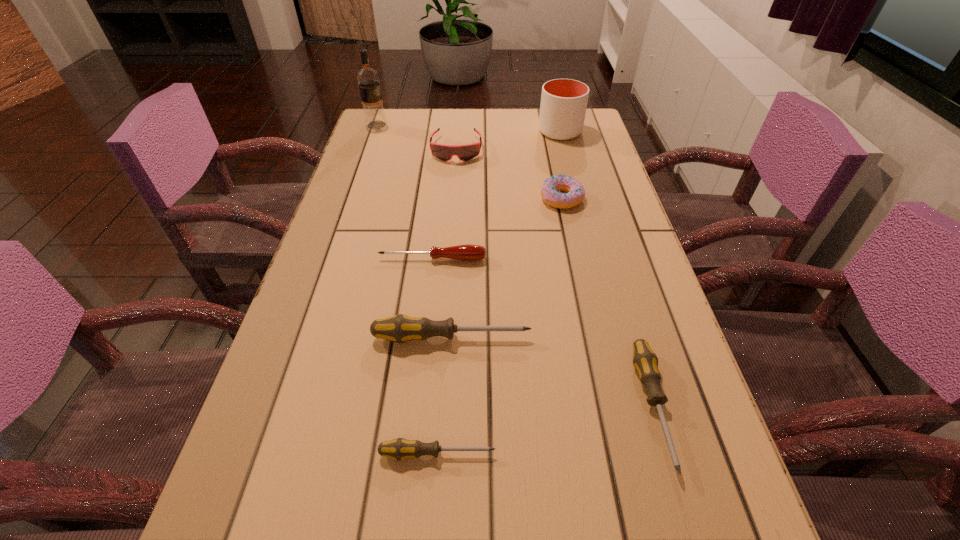
At what (x,y) coordinates should I click in order to perform the action: click on object at the far right corner. Please return your answer as a coordinate pair (x, y). This screenshot has width=960, height=540. Looking at the image, I should click on (563, 106).

You are a GUI agent. You are given a task and a screenshot of the screen. Output one action in this format:
    pyautogui.click(x=<x>, y=<y>)
    Task: Click on the vacant area at the far edge of the desktop
    The image size is (960, 540).
    Given the screenshot: What is the action you would take?
    pyautogui.click(x=421, y=118)

You are a GUI agent. You are given a task and a screenshot of the screen. Output one action in this format:
    pyautogui.click(x=<x>, y=<y>)
    Task: Click on the vacant space at the left edge of the desktop
    This screenshot has height=540, width=960.
    Given the screenshot: What is the action you would take?
    pyautogui.click(x=389, y=210)

Where is `free space at the right edge of the desktop`? The width and height of the screenshot is (960, 540). free space at the right edge of the desktop is located at coordinates (586, 227).

Find the location of a particular element. The image size is (960, 540). free space between the leftmost object and the goggles is located at coordinates (417, 137).

Identify the location of unoccupied area between the shortest screwdriver and the goggles. (446, 301).

Where is `unoccupied area between the second biggest gray screwdriver and the pink goggles`? unoccupied area between the second biggest gray screwdriver and the pink goggles is located at coordinates (555, 278).

You are a GUI agent. You are given a task and a screenshot of the screen. Output one action in this format:
    pyautogui.click(x=<x>, y=<y>)
    Task: Click on the blank region between the shortest screwdriver and the tallest object
    
    Given the screenshot: What is the action you would take?
    pyautogui.click(x=407, y=289)

You are a GUI agent. You are given a task and a screenshot of the screen. Output one action in this format:
    pyautogui.click(x=<x>, y=<y>)
    Task: Click on the vacant area between the goggles and the red screwdriver
    
    Given the screenshot: What is the action you would take?
    pyautogui.click(x=444, y=204)

Locate an element on the screen. The height and width of the screenshot is (540, 960). free area in between the doughnut and the pink goggles is located at coordinates (509, 174).